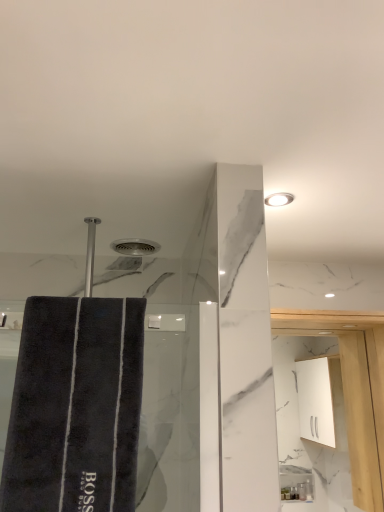
Question: Does white glossy light fixture at upper right have a lesser height compared to dark gray plush bath towel at left?

Choices:
 (A) no
 (B) yes

Answer: (B)

Question: Can we say white glossy light fixture at upper right lies outside dark gray plush bath towel at left?

Choices:
 (A) yes
 (B) no

Answer: (A)

Question: Is white glossy light fixture at upper right oriented away from dark gray plush bath towel at left?

Choices:
 (A) no
 (B) yes

Answer: (A)

Question: From a real-world perspective, does white glossy light fixture at upper right stand above dark gray plush bath towel at left?

Choices:
 (A) yes
 (B) no

Answer: (A)

Question: From the image's perspective, is white glossy light fixture at upper right beneath dark gray plush bath towel at left?

Choices:
 (A) yes
 (B) no

Answer: (B)

Question: Is white glossy light fixture at upper right to the left of dark gray plush bath towel at left from the viewer's perspective?

Choices:
 (A) yes
 (B) no

Answer: (B)

Question: Can you confirm if white glossy light fixture at upper right is wider than white glossy cabinet at upper right?

Choices:
 (A) yes
 (B) no

Answer: (A)

Question: Is white glossy light fixture at upper right oriented towards white glossy cabinet at upper right?

Choices:
 (A) no
 (B) yes

Answer: (A)

Question: From the image's perspective, is white glossy light fixture at upper right on top of white glossy cabinet at upper right?

Choices:
 (A) no
 (B) yes

Answer: (B)

Question: Is white glossy light fixture at upper right directly adjacent to white glossy cabinet at upper right?

Choices:
 (A) yes
 (B) no

Answer: (B)

Question: Is white glossy light fixture at upper right not close to white glossy cabinet at upper right?

Choices:
 (A) no
 (B) yes

Answer: (A)

Question: Does white glossy light fixture at upper right have a larger size compared to white glossy cabinet at upper right?

Choices:
 (A) yes
 (B) no

Answer: (B)

Question: Could white glossy cabinet at upper right be considered to be inside dark gray plush bath towel at left?

Choices:
 (A) yes
 (B) no

Answer: (B)